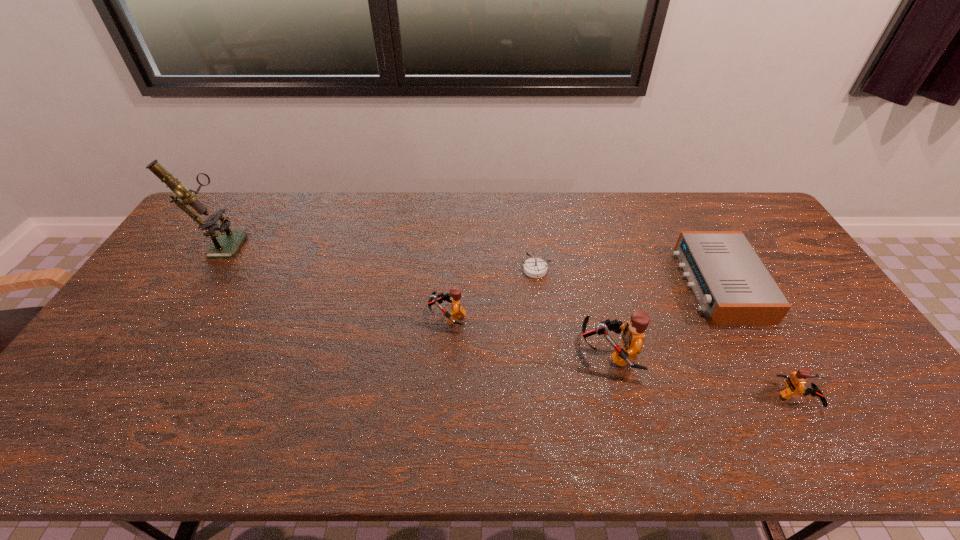
Please show where to add a Lego on the left while keeping spacing even. Please provide its 2D coordinates. Your answer should be formatted as a tuple, i.e. [(x, y)], where the tuple contains the x and y coordinates of a point satisfying the conditions above.

[(307, 285)]